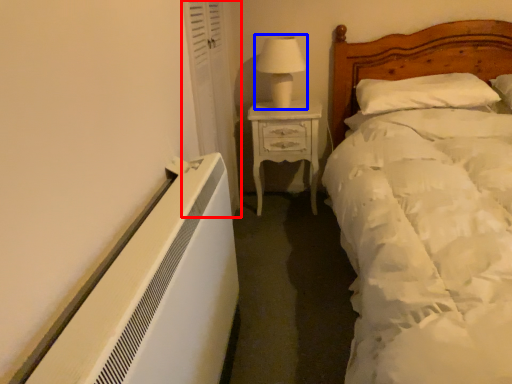
Question: Which object appears closest to the camera in this image, curtain (highlighted by a red box) or table lamp (highlighted by a blue box)?

Choices:
 (A) curtain
 (B) table lamp

Answer: (A)